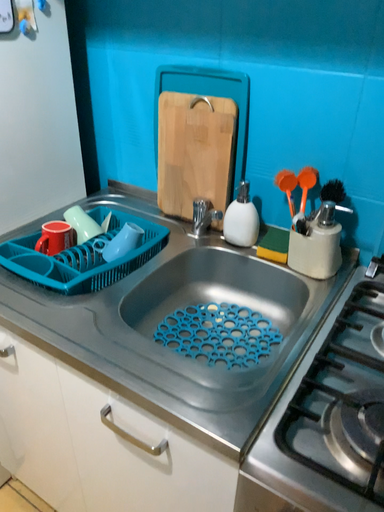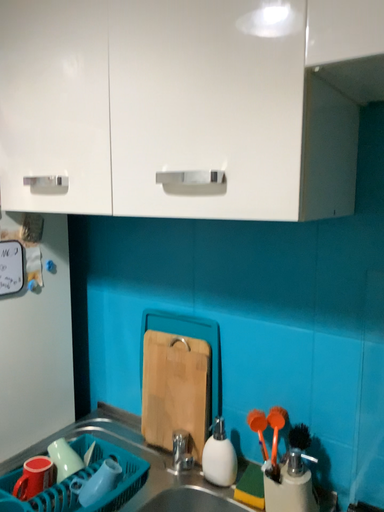
Question: Which way did the camera rotate in the video?

Choices:
 (A) rotated downward
 (B) rotated upward

Answer: (B)